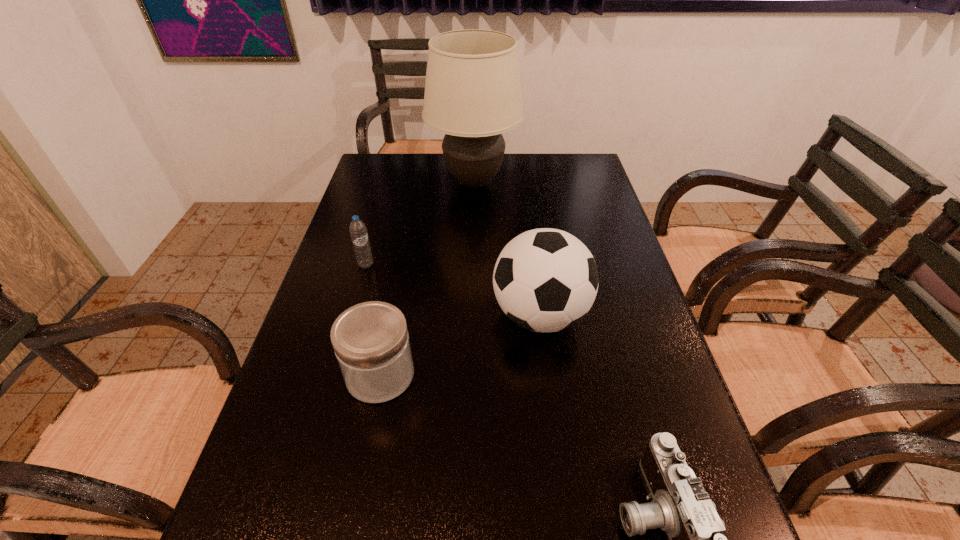
This screenshot has height=540, width=960. I want to click on unoccupied area between the lampshade and the leftmost object, so click(420, 224).

The image size is (960, 540). Identify the location of free point between the jar and the fourth shortest object. (460, 345).

At what (x,y) coordinates should I click in order to perform the action: click on vacant area between the jar and the soccer ball. Please return your answer as a coordinate pair (x, y). This screenshot has width=960, height=540. Looking at the image, I should click on (460, 345).

Identify the location of vacant area between the tallest object and the leftmost object. (420, 224).

Identify the location of object that can be found as the second closest to the nearest object. pyautogui.click(x=371, y=342).

Where is `object that is the closest to the lampshade`? Image resolution: width=960 pixels, height=540 pixels. object that is the closest to the lampshade is located at coordinates (358, 231).

At what (x,y) coordinates should I click in order to perform the action: click on vacant region that satisfies the following two spatial constraints: 1. on the front side of the jar; 2. on the left side of the water bottle. Please return your answer as a coordinate pair (x, y). The height and width of the screenshot is (540, 960). Looking at the image, I should click on (335, 375).